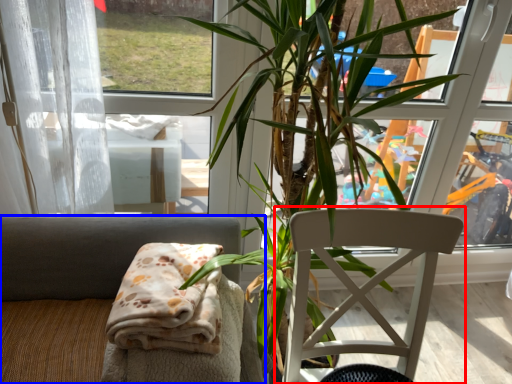
Question: Which of the following is the closest to the observer, chair (highlighted by a red box) or chair (highlighted by a blue box)?

Choices:
 (A) chair
 (B) chair

Answer: (A)